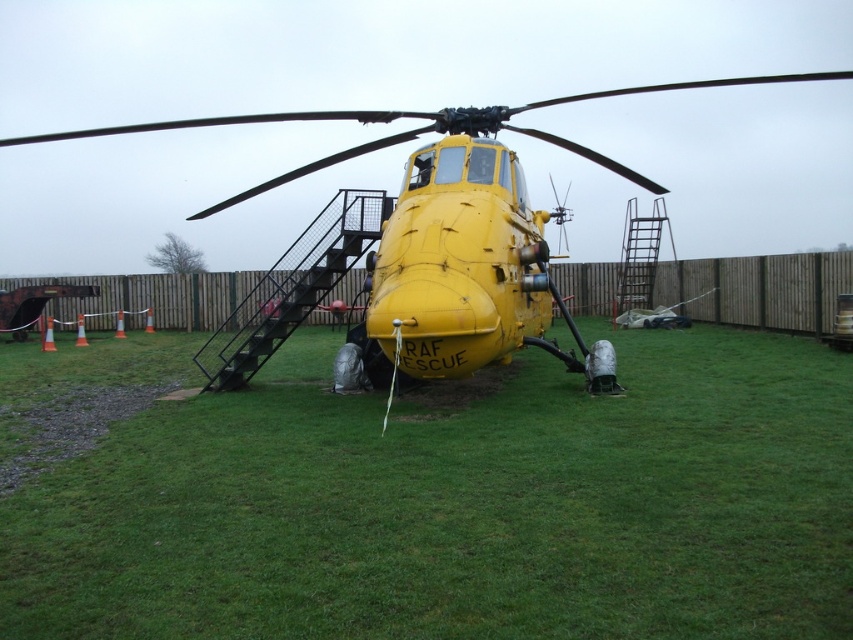
Question: Can you confirm if green grass at center is positioned to the left of yellow matte helicopter at center?

Choices:
 (A) yes
 (B) no

Answer: (B)

Question: Which point is farther to the camera?

Choices:
 (A) green grass at center
 (B) yellow matte helicopter at center

Answer: (B)

Question: Which of the following is the closest to the observer?

Choices:
 (A) green grass at center
 (B) yellow matte helicopter at center

Answer: (A)

Question: Among these points, which one is nearest to the camera?

Choices:
 (A) 572,99
 (B) 170,621

Answer: (B)

Question: Can you confirm if green grass at center is positioned to the right of yellow matte helicopter at center?

Choices:
 (A) yes
 (B) no

Answer: (A)

Question: Can you confirm if green grass at center is positioned below yellow matte helicopter at center?

Choices:
 (A) yes
 (B) no

Answer: (A)